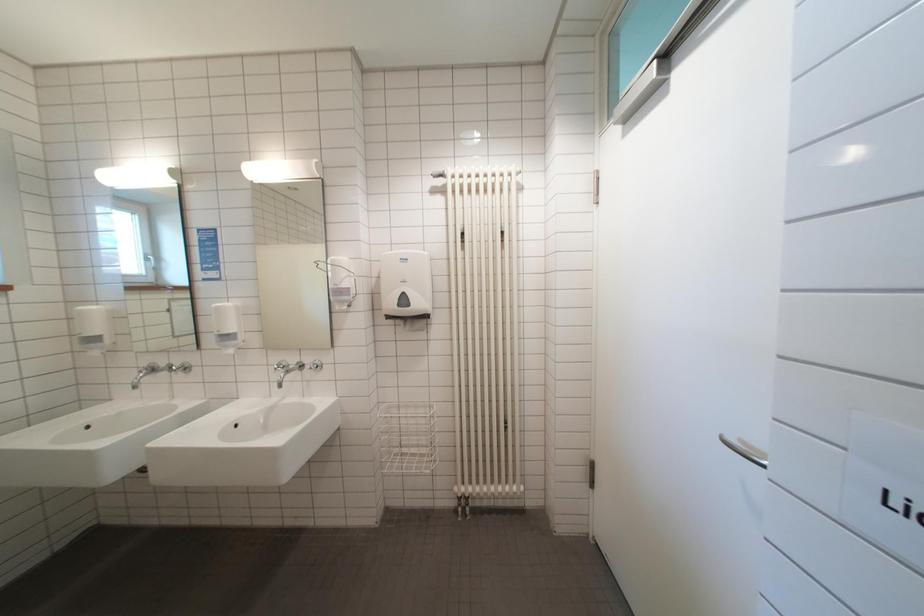
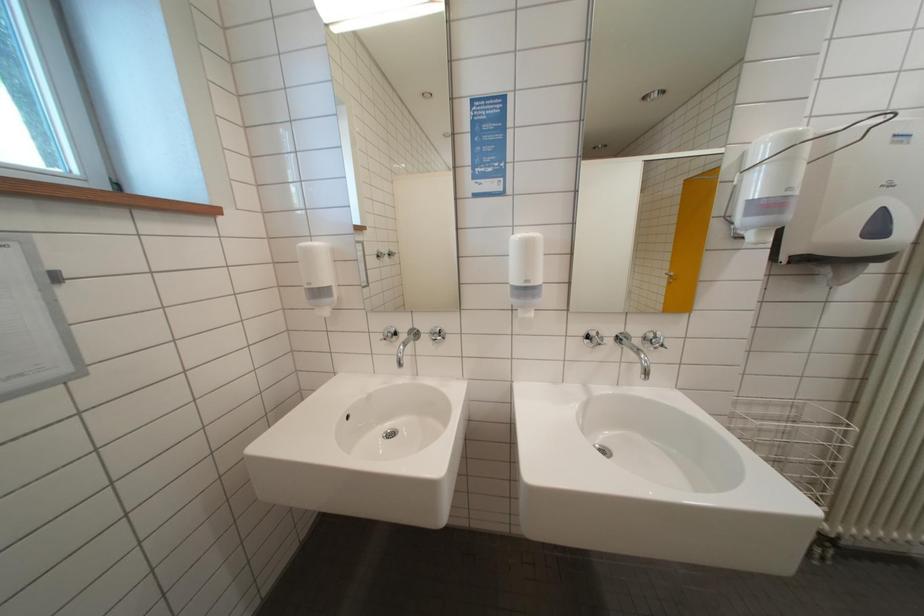
Question: In a continuous first-person perspective shot, in which direction is the camera moving?

Choices:
 (A) Left
 (B) Right
 (C) Forward
 (D) Backward

Answer: (A)